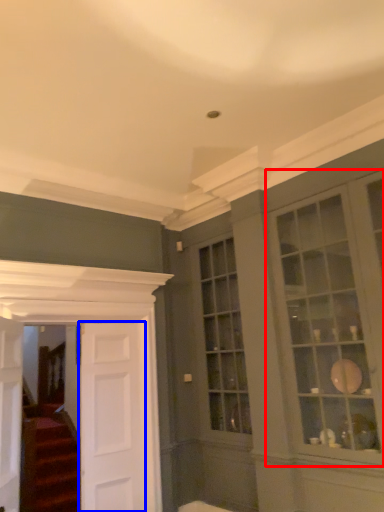
Question: Which object is further to the camera taking this photo, window (highlighted by a red box) or door (highlighted by a blue box)?

Choices:
 (A) window
 (B) door

Answer: (B)